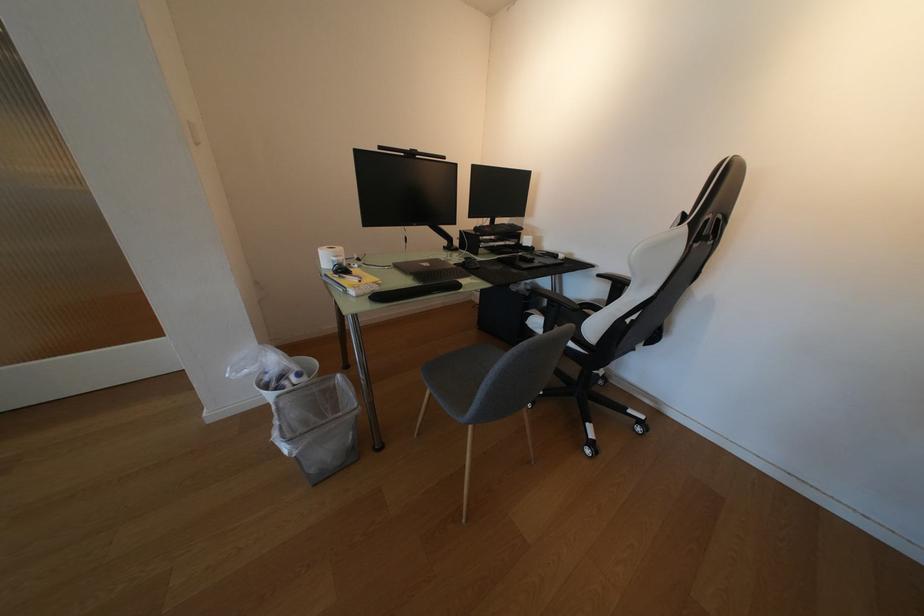
The image size is (924, 616). In order to click on computer mouse in this screenshot , I will do `click(469, 262)`.